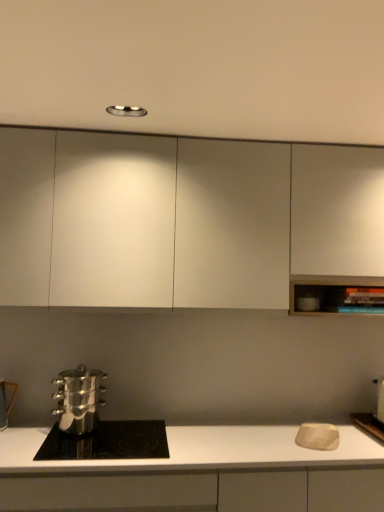
This screenshot has height=512, width=384. In order to click on free spot to the right of polished stainless steel steamer at lower left in this screenshot , I will do `click(124, 431)`.